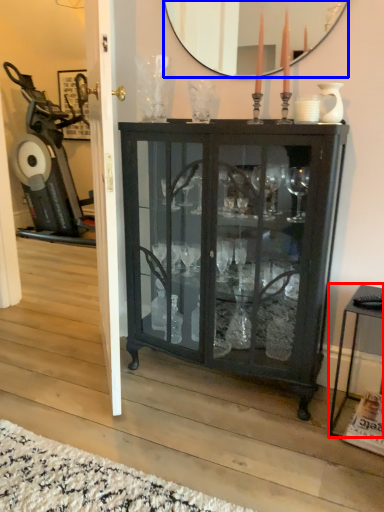
Question: Which point is further to the camera, table (highlighted by a red box) or mirror (highlighted by a blue box)?

Choices:
 (A) table
 (B) mirror

Answer: (B)